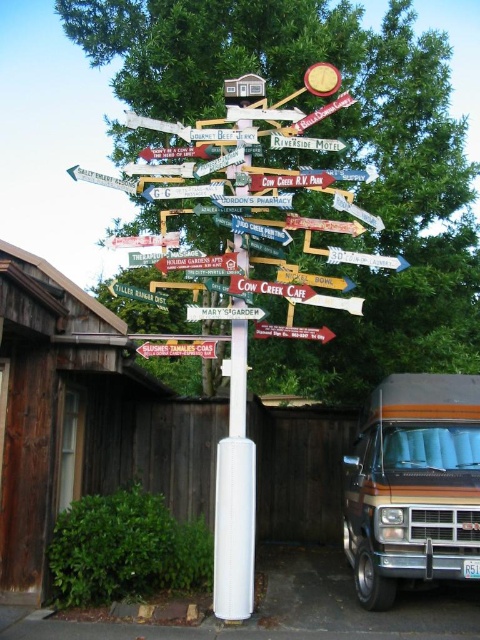
You are a painter who needs to choose between two wooden signposts to paint. The wooden signpost at center and the green painted wooden signpost at upper center. Which one do you think will require more paint due to its larger surface area?

The wooden signpost at center has a larger width than the green painted wooden signpost at upper center, so it will require more paint because of its greater surface area.

You are standing at the origin point of the coordinate system. Where is the wooden signpost at center located?

The wooden signpost at center is located at point (178, 348).